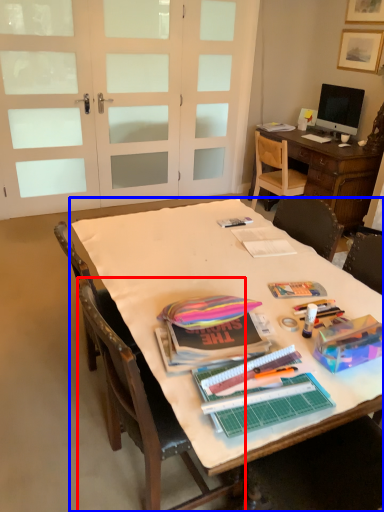
Question: Which object is closer to the camera taking this photo, chair (highlighted by a red box) or table (highlighted by a blue box)?

Choices:
 (A) chair
 (B) table

Answer: (B)